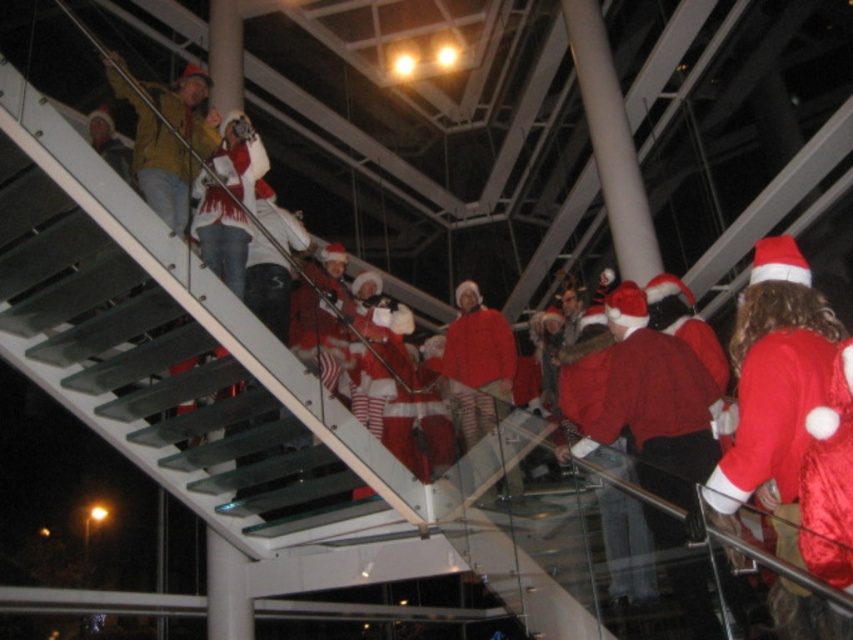
Question: Is red satin santa at right below yellow matte jacket at upper left?

Choices:
 (A) no
 (B) yes

Answer: (B)

Question: Which point is closer to the camera?

Choices:
 (A) red satin santa at right
 (B) yellow matte jacket at upper left

Answer: (A)

Question: Which of the following is the farthest from the observer?

Choices:
 (A) (187, 106)
 (B) (782, 252)

Answer: (A)

Question: Can you confirm if red satin santa at right is bigger than yellow matte jacket at upper left?

Choices:
 (A) yes
 (B) no

Answer: (B)

Question: Observing the image, what is the correct spatial positioning of red satin santa at right in reference to yellow matte jacket at upper left?

Choices:
 (A) above
 (B) below

Answer: (B)